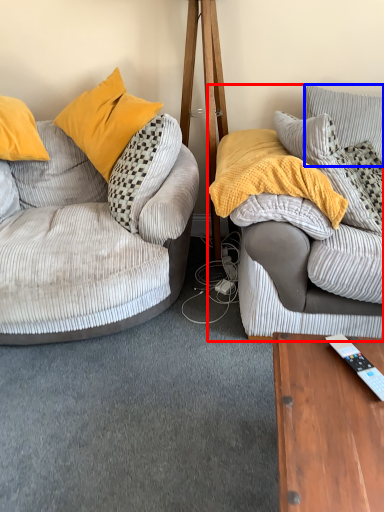
Question: Among these objects, which one is farthest to the camera, studio couch (highlighted by a red box) or pillow (highlighted by a blue box)?

Choices:
 (A) studio couch
 (B) pillow

Answer: (B)